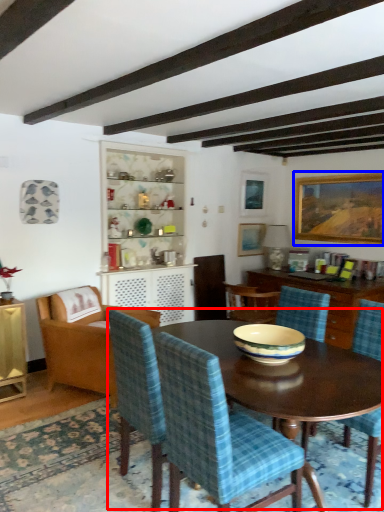
Question: Which object is closer to the camera taking this photo, kitchen & dining room table (highlighted by a red box) or picture frame (highlighted by a blue box)?

Choices:
 (A) kitchen & dining room table
 (B) picture frame

Answer: (A)